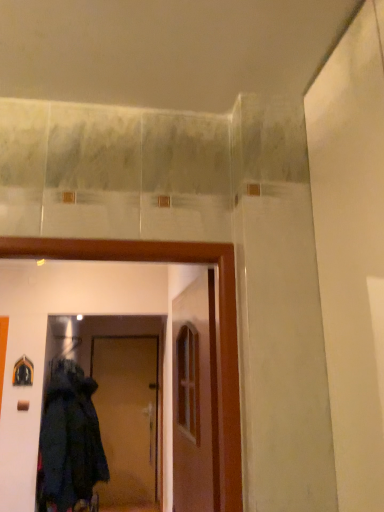
Question: Does brown matte door at center, which ranks as the second door in top-to-bottom order, have a larger size compared to dark woolen coat at lower left?

Choices:
 (A) yes
 (B) no

Answer: (B)

Question: Considering the relative sizes of brown matte door at center, the first door from the back, and dark woolen coat at lower left in the image provided, is brown matte door at center, the first door from the back, thinner than dark woolen coat at lower left?

Choices:
 (A) yes
 (B) no

Answer: (A)

Question: Is brown matte door at center, which is the second door in right-to-left order, outside dark woolen coat at lower left?

Choices:
 (A) yes
 (B) no

Answer: (A)

Question: Is brown matte door at center, which appears as the 1th door when viewed from the left, far from dark woolen coat at lower left?

Choices:
 (A) no
 (B) yes

Answer: (B)

Question: From a real-world perspective, is brown matte door at center, which is the second door in right-to-left order, on dark woolen coat at lower left?

Choices:
 (A) yes
 (B) no

Answer: (B)

Question: Does brown matte door at center, the first door from the back, appear on the left side of dark woolen coat at lower left?

Choices:
 (A) yes
 (B) no

Answer: (B)

Question: From the image's perspective, is wooden door at center, which is the first door in right-to-left order, on top of dark woolen coat at lower left?

Choices:
 (A) no
 (B) yes

Answer: (B)

Question: Does wooden door at center, the second door in the left-to-right sequence, have a smaller size compared to dark woolen coat at lower left?

Choices:
 (A) yes
 (B) no

Answer: (A)

Question: From a real-world perspective, is wooden door at center, marked as the second door in a bottom-to-top arrangement, on dark woolen coat at lower left?

Choices:
 (A) yes
 (B) no

Answer: (A)

Question: Can you confirm if wooden door at center, which is the 2th door from back to front, is taller than dark woolen coat at lower left?

Choices:
 (A) yes
 (B) no

Answer: (B)

Question: From a real-world perspective, is wooden door at center, the first door in the top-to-bottom sequence, located beneath dark woolen coat at lower left?

Choices:
 (A) yes
 (B) no

Answer: (B)

Question: Considering the relative sizes of wooden door at center, which is the first door in right-to-left order, and dark woolen coat at lower left in the image provided, is wooden door at center, which is the first door in right-to-left order, shorter than dark woolen coat at lower left?

Choices:
 (A) yes
 (B) no

Answer: (A)

Question: Is wooden door at center, marked as the second door in a bottom-to-top arrangement, turned away from brown matte door at center, which appears as the 1th door when viewed from the left?

Choices:
 (A) no
 (B) yes

Answer: (A)